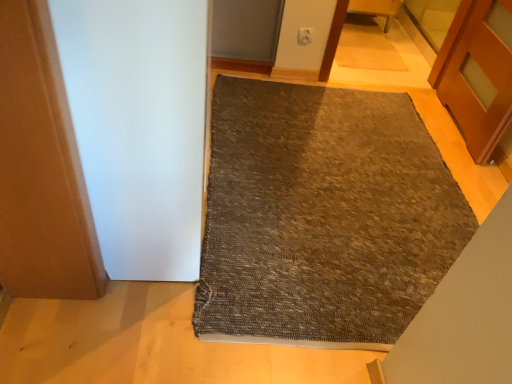
Describe the element at coordinates (479, 75) in the screenshot. I see `wooden door at right` at that location.

Identify the location of wooden door at right. (479, 75).

Measure the distance between wooden chair at upper center and white matte screen door at left.

2.87 meters.

Considering the relative sizes of wooden chair at upper center and white matte screen door at left in the image provided, is wooden chair at upper center bigger than white matte screen door at left?

Incorrect, wooden chair at upper center is not larger than white matte screen door at left.

Could you tell me if wooden chair at upper center is facing white matte screen door at left?

No, wooden chair at upper center does not turn towards white matte screen door at left.

From a real-world perspective, which object rests below the other?

In real-world perspective, wooden chair at upper center is lower.

Considering the sizes of objects textured gray mat at center and white matte screen door at left in the image provided, who is bigger, textured gray mat at center or white matte screen door at left?

With larger size is white matte screen door at left.

Is textured gray mat at center closer to camera compared to white matte screen door at left?

No, textured gray mat at center is behind white matte screen door at left.

Is textured gray mat at center completely or partially outside of white matte screen door at left?

textured gray mat at center lies outside white matte screen door at left's area.

Would you consider textured gray mat at center to be distant from white matte screen door at left?

No, textured gray mat at center is not far away from white matte screen door at left.

Where is `furniture above the textured gray mat at center (from the image's perspective)`? furniture above the textured gray mat at center (from the image's perspective) is located at coordinates (376, 9).

Is wooden chair at upper center far from textured gray mat at center?

Absolutely, wooden chair at upper center is distant from textured gray mat at center.

Considering the sizes of objects wooden chair at upper center and textured gray mat at center in the image provided, who is taller, wooden chair at upper center or textured gray mat at center?

With more height is wooden chair at upper center.

Is point (387, 17) in front of point (355, 318)?

No, it is not.

How different are the orientations of textured gray mat at center and wooden door at right in degrees?

textured gray mat at center and wooden door at right are facing 180 degrees away from each other.

In the image, there is a wooden door at right. Where is `mat below it (from a real-world perspective)`? mat below it (from a real-world perspective) is located at coordinates 322,217.

Which is more to the left, textured gray mat at center or wooden door at right?

textured gray mat at center.

From the picture: Is textured gray mat at center at the right side of wooden chair at upper center?

In fact, textured gray mat at center is to the left of wooden chair at upper center.

Considering the relative sizes of textured gray mat at center and wooden chair at upper center in the image provided, is textured gray mat at center wider than wooden chair at upper center?

Indeed, textured gray mat at center has a greater width compared to wooden chair at upper center.

Find the location of a particular element. This screenshot has height=384, width=512. mat located underneath the wooden chair at upper center (from a real-world perspective) is located at coordinates (322, 217).

Considering the relative positions of textured gray mat at center and wooden chair at upper center in the image provided, is textured gray mat at center behind wooden chair at upper center?

No.

Is wooden door at right wider than textured gray mat at center?

Incorrect, the width of wooden door at right does not surpass that of textured gray mat at center.

Considering the positions of objects wooden door at right and textured gray mat at center in the image provided, who is more to the right, wooden door at right or textured gray mat at center?

wooden door at right is more to the right.

From a real-world perspective, which object stands above the other?

wooden door at right, from a real-world perspective.

Is point (360, 2) farther from camera compared to point (490, 41)?

Yes, it is.

In the image, there is a wooden door at right. Where is `furniture above it (from the image's perspective)`? This screenshot has width=512, height=384. furniture above it (from the image's perspective) is located at coordinates (376, 9).

Consider the image. Which object is more forward, wooden chair at upper center or wooden door at right?

wooden door at right is closer to the camera.

I want to click on screen door above the wooden chair at upper center (from a real-world perspective), so click(139, 127).

Identify the location of mat that appears on the right of white matte screen door at left. The image size is (512, 384). (322, 217).

Based on their spatial positions, is white matte screen door at left or textured gray mat at center closer to wooden chair at upper center?

textured gray mat at center lies closer to wooden chair at upper center than the other object.

Based on their spatial positions, is textured gray mat at center or wooden chair at upper center closer to white matte screen door at left?

The object closer to white matte screen door at left is textured gray mat at center.

Based on their spatial positions, is white matte screen door at left or wooden chair at upper center further from wooden door at right?

white matte screen door at left is further to wooden door at right.

Considering their positions, is wooden chair at upper center positioned closer to white matte screen door at left than wooden door at right?

wooden door at right.

Based on their spatial positions, is white matte screen door at left or wooden door at right further from wooden chair at upper center?

white matte screen door at left.

From the image, which object appears to be farther from white matte screen door at left, textured gray mat at center or wooden door at right?

wooden door at right is further to white matte screen door at left.

Based on their spatial positions, is textured gray mat at center or wooden door at right further from wooden chair at upper center?

Based on the image, textured gray mat at center appears to be further to wooden chair at upper center.

Considering their positions, is wooden chair at upper center positioned further to white matte screen door at left than textured gray mat at center?

wooden chair at upper center is positioned further to the anchor white matte screen door at left.

Find the location of a particular element. This screenshot has width=512, height=384. door located between textured gray mat at center and wooden chair at upper center in the depth direction is located at coordinates (479, 75).

Identify the location of door between white matte screen door at left and wooden chair at upper center in the front-back direction. (479, 75).

At what (x,y) coordinates should I click in order to perform the action: click on mat between white matte screen door at left and wooden door at right in the horizontal direction. Please return your answer as a coordinate pair (x, y). Looking at the image, I should click on (322, 217).

Where is `mat between white matte screen door at left and wooden chair at upper center in the front-back direction`? The width and height of the screenshot is (512, 384). mat between white matte screen door at left and wooden chair at upper center in the front-back direction is located at coordinates (322, 217).